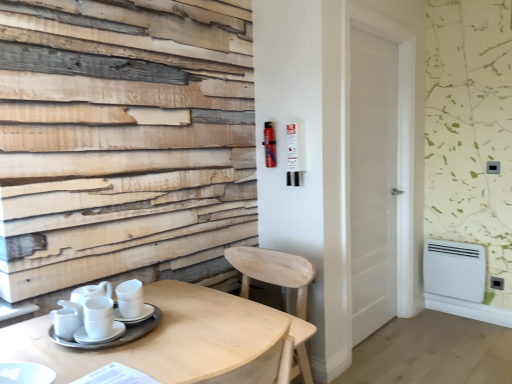
At what (x,y) coordinates should I click in order to perform the action: click on free space in front of white wooden door at center. Please return your answer as a coordinate pair (x, y). The height and width of the screenshot is (384, 512). Looking at the image, I should click on (405, 363).